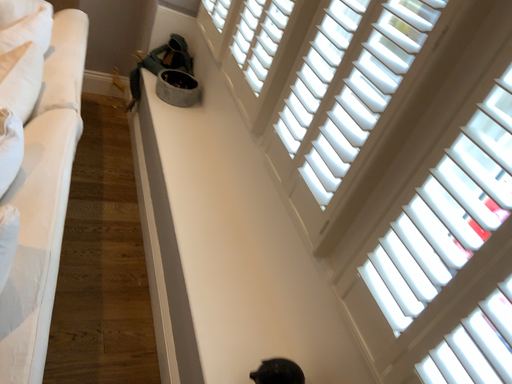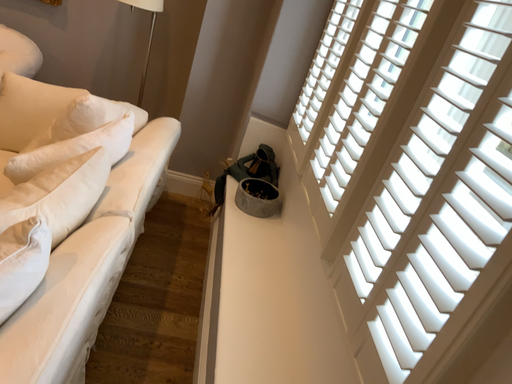
Question: Which way did the camera rotate in the video?

Choices:
 (A) rotated left
 (B) rotated right

Answer: (A)